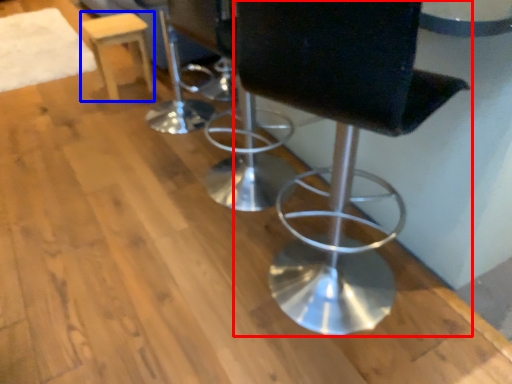
Question: Which object is closer to the camera taking this photo, chair (highlighted by a red box) or stool (highlighted by a blue box)?

Choices:
 (A) chair
 (B) stool

Answer: (A)